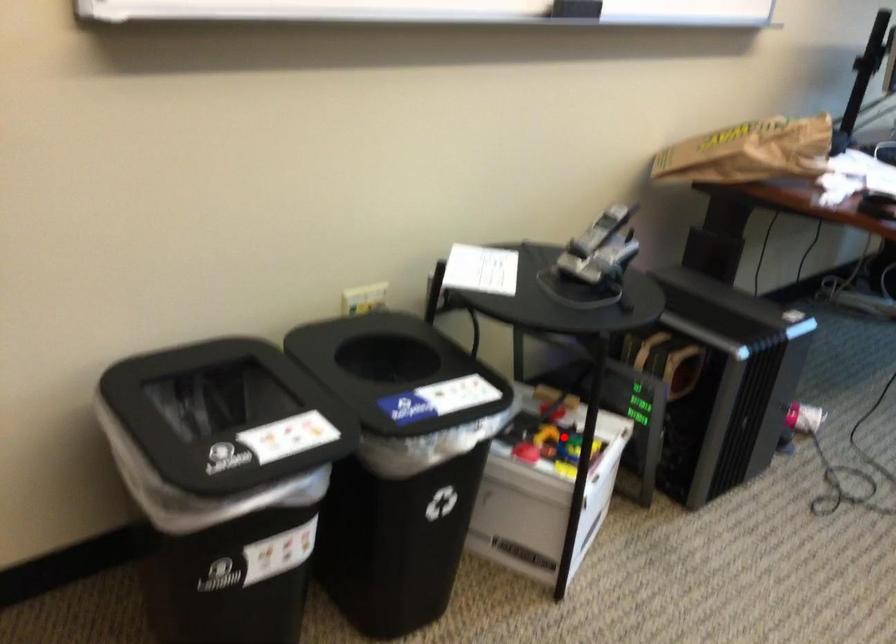
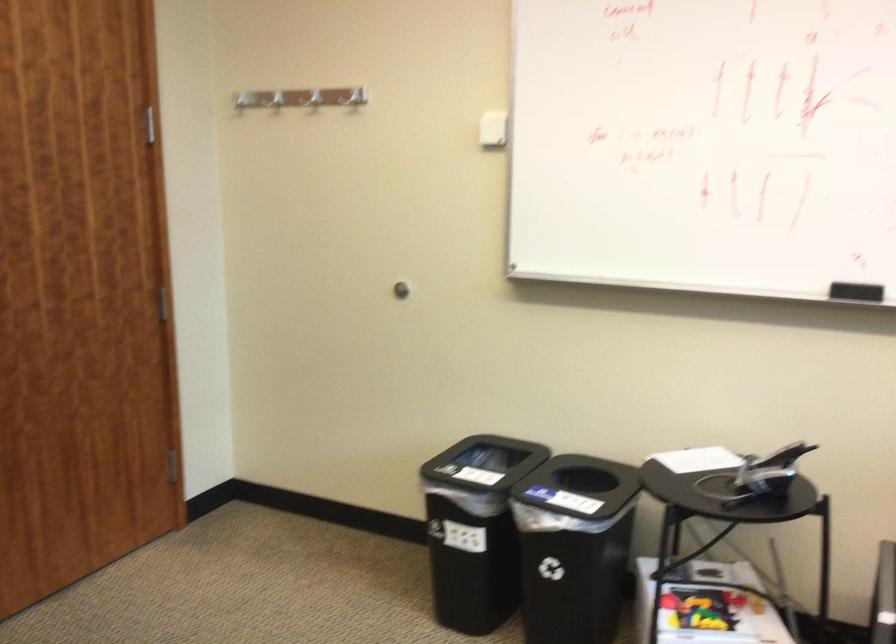
In the second image, find the point that corresponds to the highlighted location in the first image.

(701, 609)